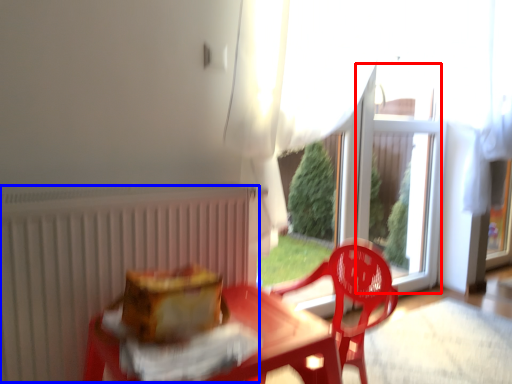
Question: Which of the following is the farthest to the observer, window screen (highlighted by a red box) or radiator (highlighted by a blue box)?

Choices:
 (A) window screen
 (B) radiator

Answer: (A)